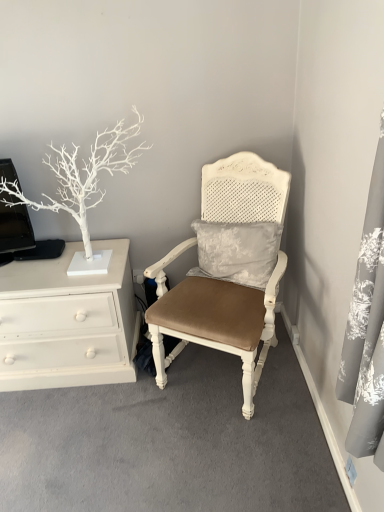
Identify the location of white painted wood chest of drawers at left. (67, 322).

Based on the photo, in order to face matte white chair at center, should I rotate leftwards or rightwards?

To align with it, rotate right about 3.950°.

Identify the location of white painted wood chest of drawers at left. (67, 322).

How far apart are white painted wood chest of drawers at left and white matte tree at left?

white painted wood chest of drawers at left is 15.15 inches from white matte tree at left.

Is white matte tree at left surrounded by white painted wood chest of drawers at left?

No, white matte tree at left is not a part of white painted wood chest of drawers at left.

Based on their sizes in the image, would you say white painted wood chest of drawers at left is bigger or smaller than white matte tree at left?

In the image, white painted wood chest of drawers at left appears to be larger than white matte tree at left.

What's the angular difference between white matte tree at left and white painted wood chest of drawers at left's facing directions?

They differ by 0.00209 degrees in their facing directions.

This screenshot has height=512, width=384. In order to click on chest of drawers behind the white matte tree at left in this screenshot , I will do `click(67, 322)`.

Is point (99, 161) more distant than point (126, 345)?

No.

Does white matte tree at left have a larger size compared to matte white chair at center?

No, white matte tree at left is not bigger than matte white chair at center.

Locate an element on the screen. This screenshot has width=384, height=512. chair in front of the white matte tree at left is located at coordinates (214, 319).

From the image's perspective, between white matte tree at left and matte white chair at center, which one is located above?

white matte tree at left.

Between white matte tree at left and matte white chair at center, which one has larger width?

matte white chair at center is wider.

From a real-world perspective, is white painted wood chest of drawers at left physically located above or below matte white chair at center?

white painted wood chest of drawers at left is below matte white chair at center.

Is white painted wood chest of drawers at left in contact with matte white chair at center?

No, white painted wood chest of drawers at left is not in contact with matte white chair at center.

Is white painted wood chest of drawers at left at the left side of matte white chair at center?

Yes, white painted wood chest of drawers at left is to the left of matte white chair at center.

Between white painted wood chest of drawers at left and matte white chair at center, which one has more height?

With more height is matte white chair at center.

Which of these two, matte white chair at center or white painted wood chest of drawers at left, is thinner?

white painted wood chest of drawers at left.

From the image's perspective, does matte white chair at center appear lower than white painted wood chest of drawers at left?

No.

From their relative heights in the image, would you say matte white chair at center is taller or shorter than white painted wood chest of drawers at left?

Clearly, matte white chair at center is taller compared to white painted wood chest of drawers at left.

Based on their positions, is matte white chair at center located to the left or right of white painted wood chest of drawers at left?

In the image, matte white chair at center appears on the right side of white painted wood chest of drawers at left.

Is matte white chair at center positioned beyond the bounds of white matte tree at left?

Yes, matte white chair at center is outside of white matte tree at left.

Is matte white chair at center positioned with its back to white matte tree at left?

No, matte white chair at center is not facing away from white matte tree at left.

Does point (211, 199) come in front of point (69, 169)?

That is False.

Image resolution: width=384 pixels, height=512 pixels. In order to click on the chest of drawers that appears below the white matte tree at left (from a real-world perspective) in this screenshot , I will do `click(67, 322)`.

I want to click on the chest of drawers below the white matte tree at left (from the image's perspective), so click(x=67, y=322).

From the image, which object appears to be nearer to white painted wood chest of drawers at left, white matte tree at left or matte white chair at center?

white matte tree at left lies closer to white painted wood chest of drawers at left than the other object.

When comparing their distances from white matte tree at left, does matte white chair at center or white painted wood chest of drawers at left seem further?

matte white chair at center.

From the image, which object appears to be farther from white matte tree at left, white painted wood chest of drawers at left or matte white chair at center?

matte white chair at center is further to white matte tree at left.

When comparing their distances from matte white chair at center, does white painted wood chest of drawers at left or white matte tree at left seem closer?

Based on the image, white painted wood chest of drawers at left appears to be nearer to matte white chair at center.

Based on their spatial positions, is white matte tree at left or white painted wood chest of drawers at left further from matte white chair at center?

Among the two, white matte tree at left is located further to matte white chair at center.

From the image, which object appears to be nearer to white painted wood chest of drawers at left, matte white chair at center or white matte tree at left?

Among the two, white matte tree at left is located nearer to white painted wood chest of drawers at left.

You are a GUI agent. You are given a task and a screenshot of the screen. Output one action in this format:
    pyautogui.click(x=<x>, y=<y>)
    Task: Click on the houseplant between white painted wood chest of drawers at left and matte white chair at center in the horizontal direction
    The height and width of the screenshot is (512, 384).
    Given the screenshot: What is the action you would take?
    pyautogui.click(x=82, y=176)